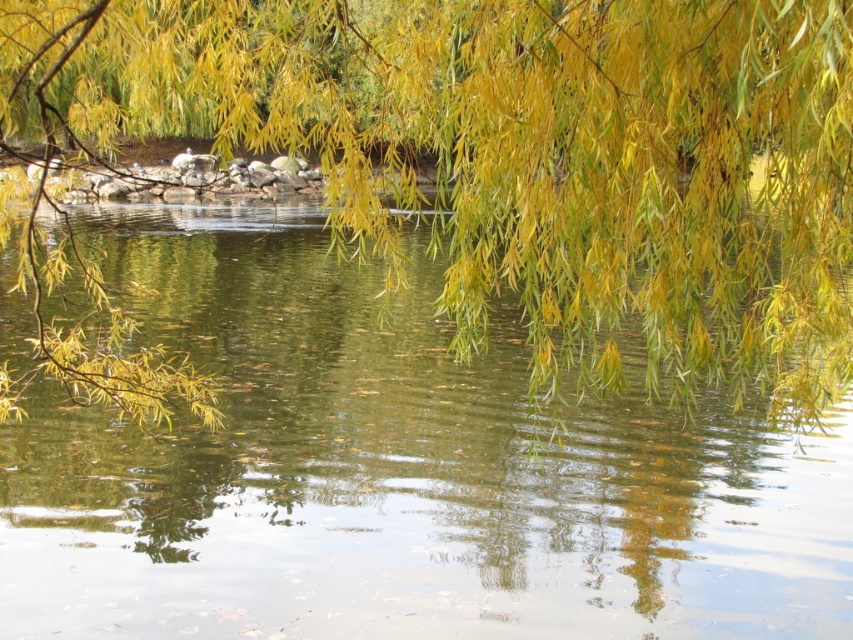
You are standing at the edge of the pond and want to locate the green reflective water at center. According to the coordinates provided, where exactly should you look?

The green reflective water at center is located at coordinates point [393,476].